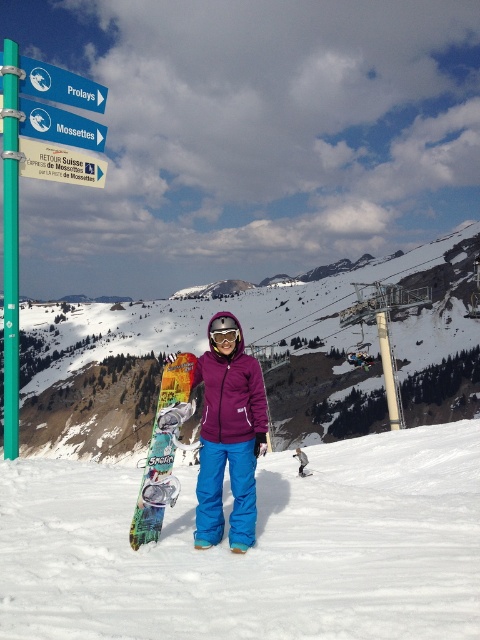
Which of these two, white plastic sign at upper left or blue plastic sign at upper left, stands taller?

white plastic sign at upper left is taller.

Between point (68, 168) and point (48, 118), which one is positioned in front?

Positioned in front is point (48, 118).

Locate an element on the screen. The image size is (480, 640). white plastic sign at upper left is located at coordinates (60, 163).

Does teal glossy pole at left appear over matte purple jacket at center?

Correct, teal glossy pole at left is located above matte purple jacket at center.

Between teal glossy pole at left and matte purple jacket at center, which one has more height?

Standing taller between the two is teal glossy pole at left.

Who is more forward, (12, 97) or (301, 456)?

Positioned in front is point (12, 97).

You are a GUI agent. You are given a task and a screenshot of the screen. Output one action in this format:
    pyautogui.click(x=<x>, y=<y>)
    Task: Click on the teal glossy pole at left
    Image resolution: width=480 pixels, height=640 pixels.
    Given the screenshot: What is the action you would take?
    pyautogui.click(x=11, y=244)

The image size is (480, 640). What do you see at coordinates (261, 358) in the screenshot? I see `white snowboard at center` at bounding box center [261, 358].

Does white snowboard at center come behind transparent orange goggles at center?

Yes, white snowboard at center is behind transparent orange goggles at center.

Is point (459, 307) positioned in front of point (231, 336)?

No, it is not.

Locate an element on the screen. The width and height of the screenshot is (480, 640). white snowboard at center is located at coordinates (261, 358).